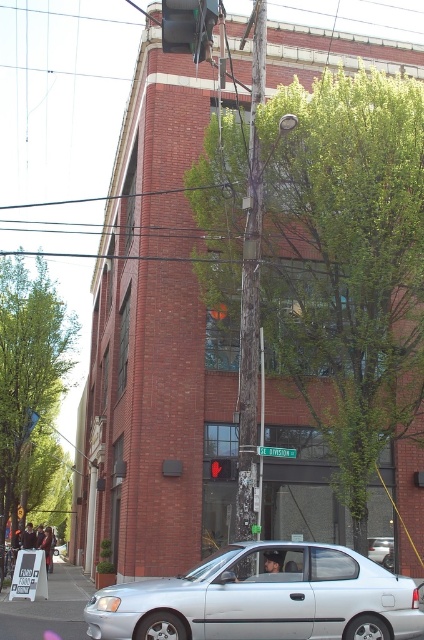
You are a delivery person trying to navigate through the street. There are two silver metallic cars in your view. Which one is closer to you, the silver metallic car at lower center or the silver metallic car at center?

The silver metallic car at lower center is taller than the silver metallic car at center, which suggests it is closer to you. Therefore, the silver metallic car at lower center is closer.